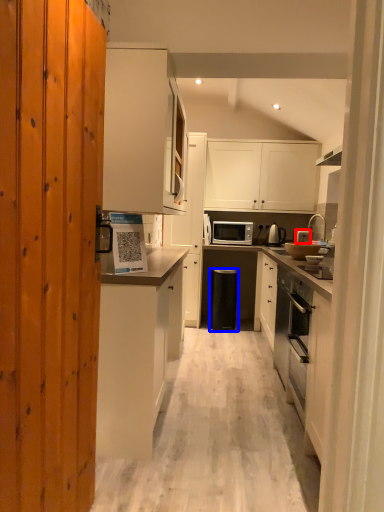
Question: Among these objects, which one is nearest to the camera, appliance (highlighted by a red box) or trash bin/can (highlighted by a blue box)?

Choices:
 (A) appliance
 (B) trash bin/can

Answer: (B)